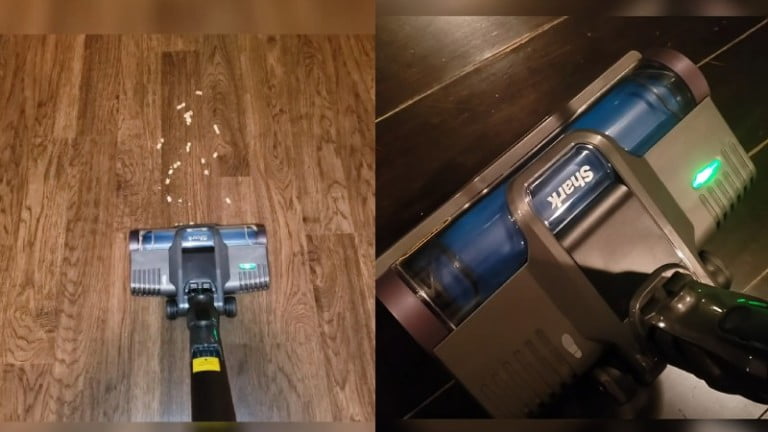
You are a GUI agent. You are given a task and a screenshot of the screen. Output one action in this format:
    pyautogui.click(x=<x>, y=<y>)
    Task: Click on the green light
    Image resolution: width=768 pixels, height=432 pixels.
    Given the screenshot: What is the action you would take?
    pyautogui.click(x=710, y=179)